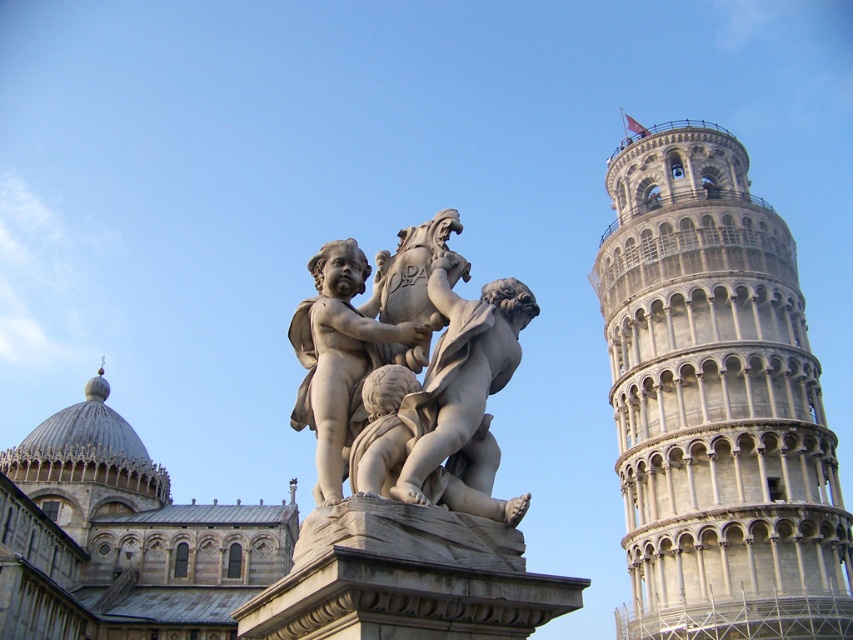
Looking at this image, what are the coordinates of the gray stone tower at right in the image?

The gray stone tower at right is located at coordinates (715, 401).

You are standing at the camera position and want to take a photo of the polished stone statue at center. If your camera has a maximum focus range of 15 meters, will you be able to focus on the statue?

The distance between the polished stone statue at center and the camera is 16.64 meters, which exceeds the camera maximum focus range of 15 meters. Therefore, the camera cannot focus on the statue.

You are an architect analyzing the spatial arrangement of the scene. Which object, the gray stone tower at right or the polished stone statue at center, is closer to the viewer?

The gray stone tower at right is closer to the viewer than the polished stone statue at center.